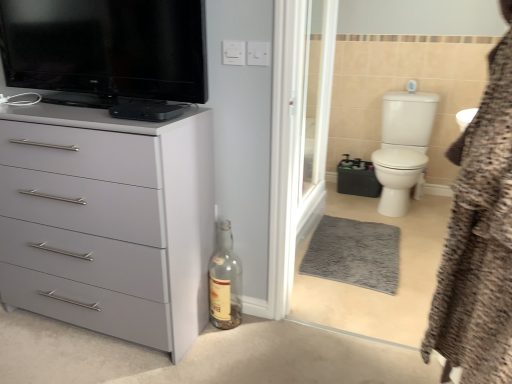
Question: From a real-world perspective, does black glossy television at upper left stand above brown textured bathrobe at right?

Choices:
 (A) yes
 (B) no

Answer: (A)

Question: Does black glossy television at upper left have a lesser width compared to brown textured bathrobe at right?

Choices:
 (A) no
 (B) yes

Answer: (B)

Question: Is brown textured bathrobe at right at the back of black glossy television at upper left?

Choices:
 (A) yes
 (B) no

Answer: (B)

Question: Can brown textured bathrobe at right be found inside black glossy television at upper left?

Choices:
 (A) yes
 (B) no

Answer: (B)

Question: Does black glossy television at upper left appear on the left side of brown textured bathrobe at right?

Choices:
 (A) no
 (B) yes

Answer: (B)

Question: From the image's perspective, would you say black glossy television at upper left is shown under brown textured bathrobe at right?

Choices:
 (A) no
 (B) yes

Answer: (A)

Question: From a real-world perspective, is brown textured bathrobe at right physically above black glossy television at upper left?

Choices:
 (A) yes
 (B) no

Answer: (B)

Question: Considering the relative sizes of brown textured bathrobe at right and black glossy television at upper left in the image provided, is brown textured bathrobe at right thinner than black glossy television at upper left?

Choices:
 (A) no
 (B) yes

Answer: (A)

Question: Is brown textured bathrobe at right positioned beyond the bounds of black glossy television at upper left?

Choices:
 (A) yes
 (B) no

Answer: (A)

Question: Can you confirm if brown textured bathrobe at right is bigger than black glossy television at upper left?

Choices:
 (A) yes
 (B) no

Answer: (A)

Question: Can you confirm if brown textured bathrobe at right is positioned to the left of black glossy television at upper left?

Choices:
 (A) no
 (B) yes

Answer: (A)

Question: From a real-world perspective, is brown textured bathrobe at right beneath black glossy television at upper left?

Choices:
 (A) yes
 (B) no

Answer: (A)

Question: Is white glossy toilet bowl at right thinner than black glossy television at upper left?

Choices:
 (A) yes
 (B) no

Answer: (B)